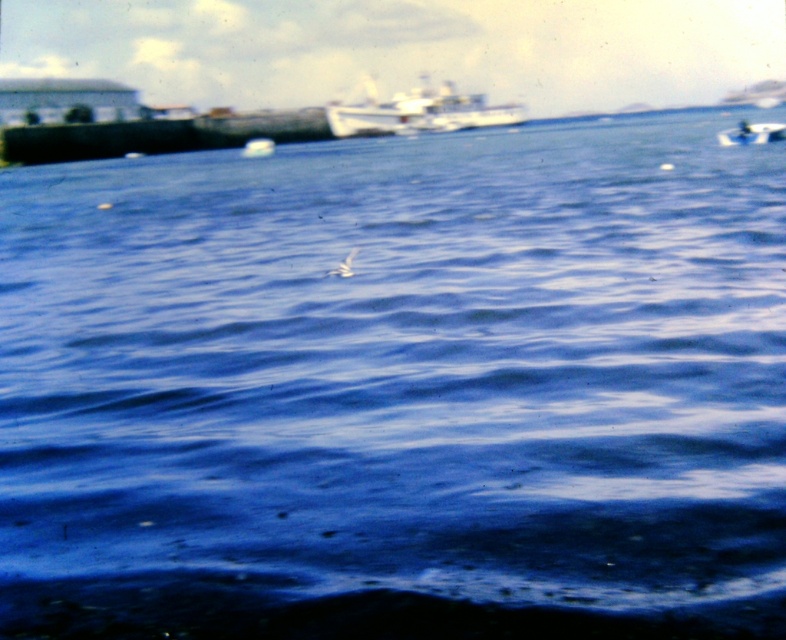
Between white matte boat at upper center and white plastic boat at upper right, which one has less height?

white plastic boat at upper right

Is point (401, 122) positioned behind point (762, 132)?

Yes, point (401, 122) is behind point (762, 132).

Who is more distant from viewer, [483,113] or [739,131]?

Point [483,113]

Find the location of a particular element. The height and width of the screenshot is (640, 786). white matte boat at upper center is located at coordinates (417, 112).

Which is more to the left, white plastic boat at upper right or white matte bird at center?

Positioned to the left is white matte bird at center.

The height and width of the screenshot is (640, 786). What do you see at coordinates (751, 132) in the screenshot?
I see `white plastic boat at upper right` at bounding box center [751, 132].

At what (x,y) coordinates should I click in order to perform the action: click on white plastic boat at upper right. Please return your answer as a coordinate pair (x, y). The image size is (786, 640). Looking at the image, I should click on (751, 132).

Between white matte boat at upper center and white matte bird at center, which one has more height?

Standing taller between the two is white matte boat at upper center.

Is point (417, 104) positioned after point (355, 253)?

That is True.

The image size is (786, 640). Describe the element at coordinates (417, 112) in the screenshot. I see `white matte boat at upper center` at that location.

Identify the location of white matte boat at upper center. (417, 112).